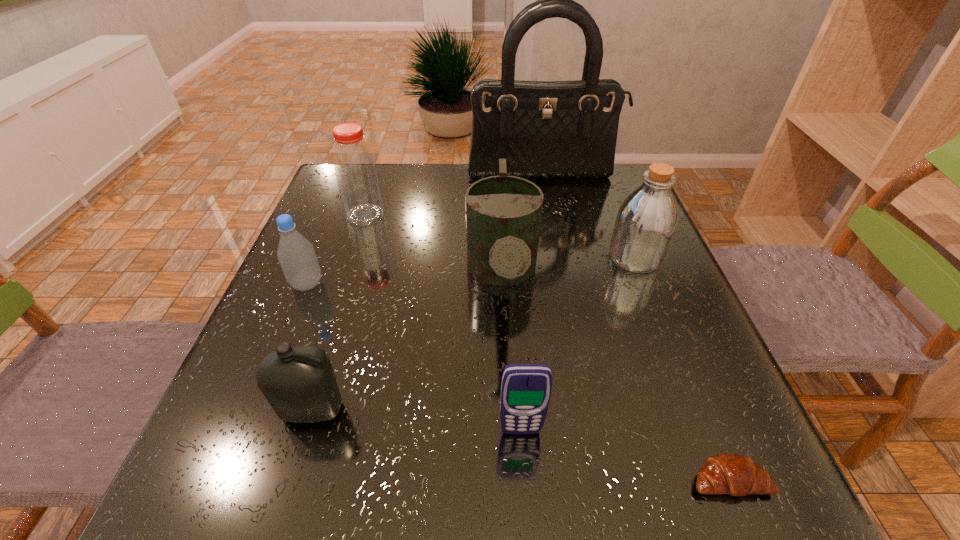
Where is `vacant area located on the front of the farthest bottle`? The width and height of the screenshot is (960, 540). vacant area located on the front of the farthest bottle is located at coordinates (339, 295).

This screenshot has height=540, width=960. I want to click on free space located 0.150m on the back of the rightmost bottle, so click(614, 206).

Where is `vacant region located 0.220m with the spout on the watering can`? vacant region located 0.220m with the spout on the watering can is located at coordinates (513, 462).

This screenshot has width=960, height=540. In order to click on free space located on the back of the nearest bottle in this screenshot , I will do `click(361, 253)`.

Find the location of a particular element. vacant space situated on the front-facing side of the cellular telephone is located at coordinates (527, 509).

Where is `vacant area located on the back of the shortest object`? This screenshot has width=960, height=540. vacant area located on the back of the shortest object is located at coordinates [x=687, y=376].

Locate an element on the screen. This screenshot has width=960, height=540. handbag located in the far edge section of the desktop is located at coordinates (544, 129).

The width and height of the screenshot is (960, 540). Find the location of `bottle that is at the far edge`. bottle that is at the far edge is located at coordinates (356, 174).

Identify the location of object positioned at the near edge. The width and height of the screenshot is (960, 540). (736, 475).

The image size is (960, 540). What are the coordinates of `handbag at the right edge` in the screenshot? It's located at (544, 129).